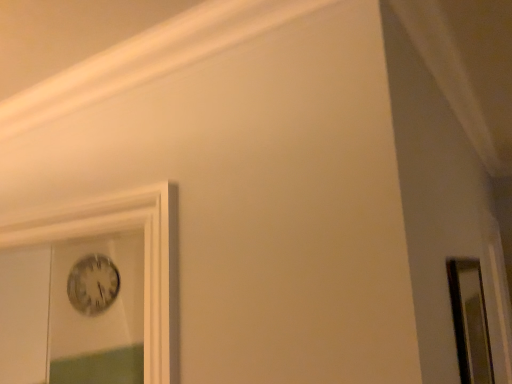
Locate an element on the screen. clear glass mirror at right is located at coordinates (470, 320).

What do you see at coordinates (470, 320) in the screenshot? The image size is (512, 384). I see `clear glass mirror at right` at bounding box center [470, 320].

What are the coordinates of `metallic silver clock at upper left` in the screenshot? It's located at (93, 284).

What do you see at coordinates (93, 284) in the screenshot? This screenshot has width=512, height=384. I see `metallic silver clock at upper left` at bounding box center [93, 284].

The image size is (512, 384). In order to click on clear glass mirror at right in this screenshot , I will do click(x=470, y=320).

Is metallic silver clock at upper left at the left side of clear glass mirror at right?

Yes.

From the picture: Is metallic silver clock at upper left in front of clear glass mirror at right?

No, the depth of metallic silver clock at upper left is greater than that of clear glass mirror at right.

Considering the positions of points (112, 293) and (464, 383), is point (112, 293) farther from camera compared to point (464, 383)?

Yes, it is behind point (464, 383).

From the image's perspective, is metallic silver clock at upper left above or below clear glass mirror at right?

Clearly, from the image's perspective, metallic silver clock at upper left is below clear glass mirror at right.

From a real-world perspective, between metallic silver clock at upper left and clear glass mirror at right, who is vertically lower?

clear glass mirror at right, from a real-world perspective.

Considering the relative sizes of metallic silver clock at upper left and clear glass mirror at right in the image provided, is metallic silver clock at upper left thinner than clear glass mirror at right?

Yes.

Is metallic silver clock at upper left taller or shorter than clear glass mirror at right?

metallic silver clock at upper left is shorter than clear glass mirror at right.

Considering the sizes of objects metallic silver clock at upper left and clear glass mirror at right in the image provided, who is smaller, metallic silver clock at upper left or clear glass mirror at right?

metallic silver clock at upper left is smaller.

Is metallic silver clock at upper left not inside clear glass mirror at right?

Yes, metallic silver clock at upper left is not within clear glass mirror at right.

Is metallic silver clock at upper left next to clear glass mirror at right and touching it?

metallic silver clock at upper left and clear glass mirror at right are not in contact.

Is metallic silver clock at upper left facing away from clear glass mirror at right?

No, metallic silver clock at upper left's orientation is not away from clear glass mirror at right.

Where is `clock located on the left of clear glass mirror at right`? This screenshot has width=512, height=384. clock located on the left of clear glass mirror at right is located at coordinates (93, 284).

Considering the positions of objects clear glass mirror at right and metallic silver clock at upper left in the image provided, who is more to the right, clear glass mirror at right or metallic silver clock at upper left?

clear glass mirror at right.

Does clear glass mirror at right lie in front of metallic silver clock at upper left?

Yes, clear glass mirror at right is closer to the camera.

Which is less distant, (467, 346) or (100, 260)?

The point (467, 346) is in front.

From the image's perspective, is clear glass mirror at right beneath metallic silver clock at upper left?

Incorrect, from the image's perspective, clear glass mirror at right is higher than metallic silver clock at upper left.

From a real-world perspective, is clear glass mirror at right under metallic silver clock at upper left?

Correct, in the physical world, clear glass mirror at right is lower than metallic silver clock at upper left.

From the picture: In terms of width, does clear glass mirror at right look wider or thinner when compared to metallic silver clock at upper left?

Clearly, clear glass mirror at right has more width compared to metallic silver clock at upper left.

Can you confirm if clear glass mirror at right is taller than metallic silver clock at upper left?

Yes, clear glass mirror at right is taller than metallic silver clock at upper left.

Consider the image. Can you confirm if clear glass mirror at right is bigger than metallic silver clock at upper left?

Indeed, clear glass mirror at right has a larger size compared to metallic silver clock at upper left.

Is clear glass mirror at right located outside metallic silver clock at upper left?

Yes.

Does clear glass mirror at right touch metallic silver clock at upper left?

There is a gap between clear glass mirror at right and metallic silver clock at upper left.

Is clear glass mirror at right aimed at metallic silver clock at upper left?

No, clear glass mirror at right is not facing towards metallic silver clock at upper left.

Image resolution: width=512 pixels, height=384 pixels. What are the coordinates of `mirror on the right of metallic silver clock at upper left` in the screenshot? It's located at (470, 320).

Image resolution: width=512 pixels, height=384 pixels. In order to click on clock that is on the left side of clear glass mirror at right in this screenshot , I will do `click(93, 284)`.

I want to click on clock behind the clear glass mirror at right, so click(x=93, y=284).